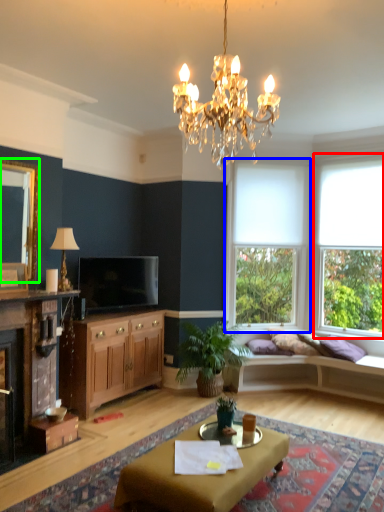
Question: Which object is positioned closest to window (highlighted by a red box)? Select from window (highlighted by a blue box) and mirror (highlighted by a green box).

Choices:
 (A) window
 (B) mirror

Answer: (A)